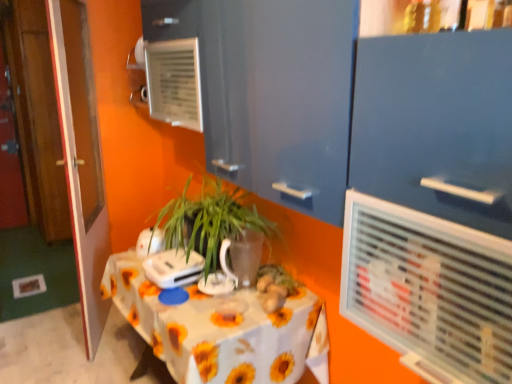
At what (x,y) coordinates should I click in order to perform the action: click on vacant area situated to the left side of wooden door at left. Please return your answer as a coordinate pair (x, y). The image size is (512, 384). Looking at the image, I should click on [58, 329].